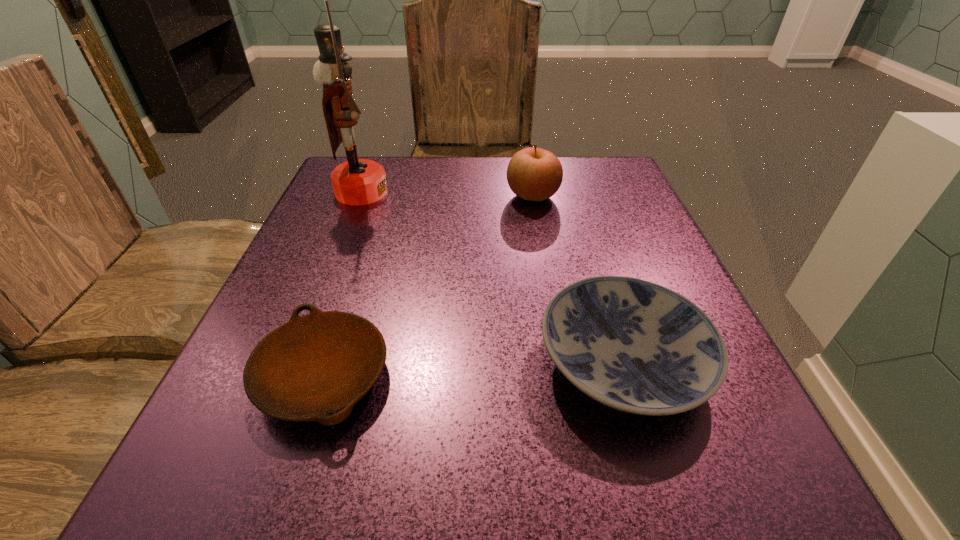
Identify the location of free space between the left plate and the taller plate. This screenshot has height=540, width=960. (473, 369).

What are the coordinates of `vacant area between the left plate and the right plate` in the screenshot? It's located at (473, 369).

Point out which object is positioned as the second nearest to the tallest object. Please provide its 2D coordinates. Your answer should be formatted as a tuple, i.e. [(x, y)], where the tuple contains the x and y coordinates of a point satisfying the conditions above.

[(316, 367)]

Where is `object that is the second nearest to the shortest object`? object that is the second nearest to the shortest object is located at coordinates (357, 181).

Locate an element on the screen. free region that satisfies the following two spatial constraints: 1. on the front-facing side of the apple; 2. on the left side of the tallest object is located at coordinates (360, 196).

Locate an element on the screen. This screenshot has height=540, width=960. free space that satisfies the following two spatial constraints: 1. on the front-facing side of the nutcracker; 2. on the back side of the third shortest object is located at coordinates (360, 196).

Locate an element on the screen. The height and width of the screenshot is (540, 960). vacant space that satisfies the following two spatial constraints: 1. on the front-facing side of the tallest object; 2. on the right side of the shorter plate is located at coordinates (289, 376).

Identify the location of vacant space that satisfies the following two spatial constraints: 1. on the front-facing side of the nutcracker; 2. on the back side of the left plate. Image resolution: width=960 pixels, height=540 pixels. (289, 376).

In order to click on vacant position in the image that satisfies the following two spatial constraints: 1. on the front-facing side of the right plate; 2. on the right side of the tallest object in this screenshot , I will do point(295,362).

At what (x,y) coordinates should I click in order to perform the action: click on vacant region that satisfies the following two spatial constraints: 1. on the front-facing side of the third tallest object; 2. on the right side of the tallest object. Please return your answer as a coordinate pair (x, y). The image size is (960, 540). Looking at the image, I should click on (295, 362).